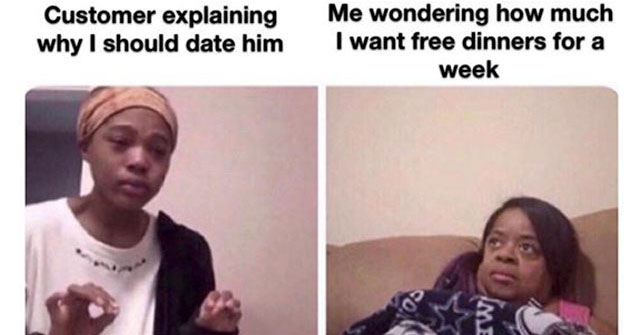
Locate an element on the screen. Image resolution: width=640 pixels, height=335 pixels. pictures is located at coordinates (207, 176), (412, 151).